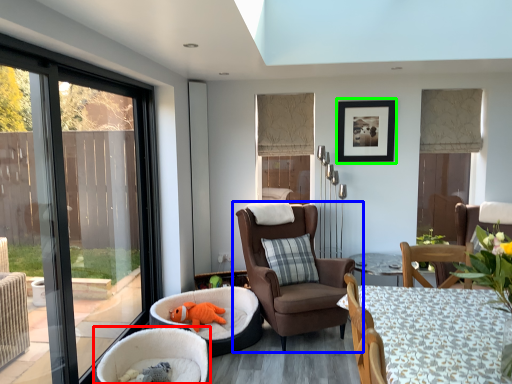
Question: Which object is the farthest from chair (highlighted by a red box)? Choose among these: chair (highlighted by a blue box) or picture frame (highlighted by a green box).

Choices:
 (A) chair
 (B) picture frame

Answer: (B)